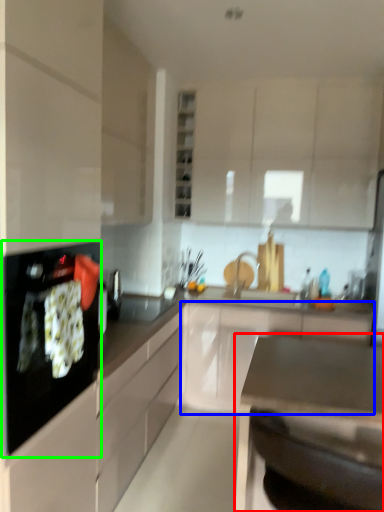
Question: Which object is the closest to the countertop (highlighted by a red box)? Choose among these: cabinetry (highlighted by a blue box) or kitchen appliance (highlighted by a green box).

Choices:
 (A) cabinetry
 (B) kitchen appliance

Answer: (B)